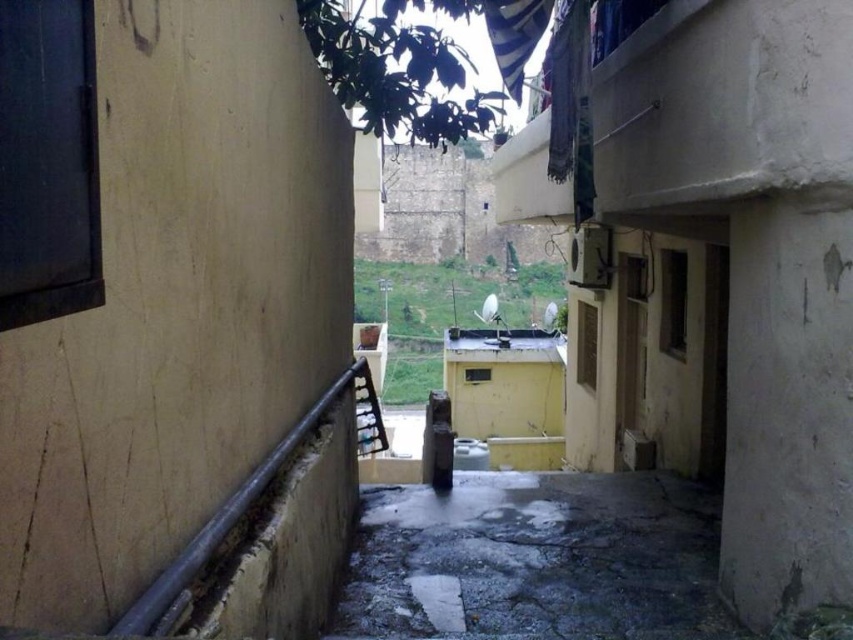
Between rusty metal rail at left and wooden at center, which one is positioned higher?

rusty metal rail at left is above.

Based on the photo, is rusty metal rail at left above wooden at center?

Yes.

The image size is (853, 640). What are the coordinates of `rusty metal rail at left` in the screenshot? It's located at (218, 529).